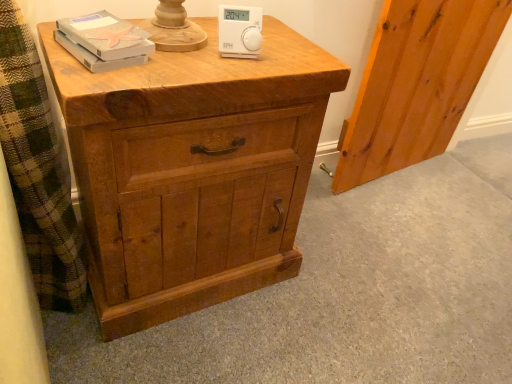
At what (x,y) coordinates should I click in order to perform the action: click on white plastic thermostat at upper center. Please return your answer as a coordinate pair (x, y). This screenshot has height=384, width=512. Looking at the image, I should click on (240, 31).

This screenshot has width=512, height=384. Describe the element at coordinates (240, 31) in the screenshot. I see `white plastic thermostat at upper center` at that location.

What do you see at coordinates (417, 84) in the screenshot?
I see `natural wood screen door at right` at bounding box center [417, 84].

Where is `natural wood chest of drawers at center`? The width and height of the screenshot is (512, 384). natural wood chest of drawers at center is located at coordinates (192, 170).

This screenshot has width=512, height=384. Identify the location of white plastic thermostat at upper center. (240, 31).

From the image's perspective, is natural wood screen door at right positioned above or below natural wood chest of drawers at center?

From the image's perspective, natural wood screen door at right appears above natural wood chest of drawers at center.

Considering the positions of point (416, 67) and point (113, 308), is point (416, 67) closer or farther from the camera than point (113, 308)?

Clearly, point (416, 67) is more distant from the camera than point (113, 308).

Is natural wood screen door at right looking in the opposite direction of natural wood chest of drawers at center?

No, natural wood screen door at right is not facing away from natural wood chest of drawers at center.

From a real-world perspective, which object stands above the other?

From a 3D spatial view, matte gray book at upper left is above.

Does matte gray book at upper left have a smaller size compared to natural wood chest of drawers at center?

Yes, matte gray book at upper left is smaller than natural wood chest of drawers at center.

Between matte gray book at upper left and natural wood chest of drawers at center, which one is positioned in front?

Positioned in front is natural wood chest of drawers at center.

Does point (77, 17) come closer to viewer compared to point (205, 81)?

No.

Can you confirm if natural wood chest of drawers at center is taller than natural wood screen door at right?

No.

Is natural wood chest of drawers at center spatially inside natural wood screen door at right, or outside of it?

The correct answer is: outside.

From a real-world perspective, is natural wood chest of drawers at center above or below natural wood screen door at right?

natural wood chest of drawers at center is situated lower than natural wood screen door at right in the real world.

Does natural wood chest of drawers at center have a smaller size compared to matte gray book at upper left?

No.

Is natural wood chest of drawers at center not inside matte gray book at upper left?

natural wood chest of drawers at center is positioned outside matte gray book at upper left.

Which object is closer to the camera taking this photo, natural wood chest of drawers at center or matte gray book at upper left?

natural wood chest of drawers at center is closer to the camera.

Can you tell me how much natural wood chest of drawers at center and matte gray book at upper left differ in facing direction?

The angular difference between natural wood chest of drawers at center and matte gray book at upper left is 13.2 degrees.

From a real-world perspective, between natural wood screen door at right and white plastic thermostat at upper center, who is vertically lower?

From a 3D spatial view, natural wood screen door at right is below.

Which object is wider, natural wood screen door at right or white plastic thermostat at upper center?

natural wood screen door at right is wider.

Based on their positions, is natural wood screen door at right located to the left or right of white plastic thermostat at upper center?

In the image, natural wood screen door at right appears on the right side of white plastic thermostat at upper center.

How different are the orientations of natural wood screen door at right and white plastic thermostat at upper center in degrees?

natural wood screen door at right and white plastic thermostat at upper center are facing 21.2 degrees away from each other.

Are matte gray book at upper left and natural wood screen door at right far apart?

Absolutely, matte gray book at upper left is distant from natural wood screen door at right.

How distant is matte gray book at upper left from natural wood screen door at right?

matte gray book at upper left and natural wood screen door at right are 3.40 feet apart from each other.

From the image's perspective, is matte gray book at upper left above or below natural wood screen door at right?

Based on their image positions, matte gray book at upper left is located beneath natural wood screen door at right.

Who is taller, matte gray book at upper left or natural wood screen door at right?

Standing taller between the two is natural wood screen door at right.

Which of these two, white plastic thermostat at upper center or natural wood screen door at right, is thinner?

Thinner between the two is white plastic thermostat at upper center.

Considering the relative positions of white plastic thermostat at upper center and natural wood screen door at right in the image provided, is white plastic thermostat at upper center to the left or to the right of natural wood screen door at right?

Clearly, white plastic thermostat at upper center is on the left of natural wood screen door at right in the image.

How much distance is there between white plastic thermostat at upper center and natural wood screen door at right?

The distance of white plastic thermostat at upper center from natural wood screen door at right is 34.54 inches.

Between white plastic thermostat at upper center and natural wood screen door at right, which one has less height?

white plastic thermostat at upper center is shorter.

Where is `the chest of drawers that is below the natural wood screen door at right (from the image's perspective)`? the chest of drawers that is below the natural wood screen door at right (from the image's perspective) is located at coordinates (192, 170).

Find the location of a particular element. This screenshot has width=512, height=384. the chest of drawers that appears in front of the matte gray book at upper left is located at coordinates (192, 170).

Estimate the real-world distances between objects in this image. Which object is further from natural wood chest of drawers at center, natural wood screen door at right or matte gray book at upper left?

Based on the image, natural wood screen door at right appears to be further to natural wood chest of drawers at center.

From the image, which object appears to be farther from natural wood screen door at right, white plastic thermostat at upper center or matte gray book at upper left?

matte gray book at upper left.

From the image, which object appears to be farther from natural wood chest of drawers at center, matte gray book at upper left or natural wood screen door at right?

The object further to natural wood chest of drawers at center is natural wood screen door at right.

Looking at the image, which one is located closer to matte gray book at upper left, natural wood screen door at right or natural wood chest of drawers at center?

The object closer to matte gray book at upper left is natural wood chest of drawers at center.

Estimate the real-world distances between objects in this image. Which object is further from matte gray book at upper left, white plastic thermostat at upper center or natural wood chest of drawers at center?

natural wood chest of drawers at center.

When comparing their distances from matte gray book at upper left, does white plastic thermostat at upper center or natural wood screen door at right seem further?

natural wood screen door at right.

In the scene shown: Based on their spatial positions, is natural wood chest of drawers at center or white plastic thermostat at upper center further from natural wood screen door at right?

white plastic thermostat at upper center lies further to natural wood screen door at right than the other object.

Estimate the real-world distances between objects in this image. Which object is further from white plastic thermostat at upper center, natural wood screen door at right or matte gray book at upper left?

The object further to white plastic thermostat at upper center is natural wood screen door at right.

This screenshot has height=384, width=512. I want to click on ipod located between matte gray book at upper left and natural wood screen door at right in the left-right direction, so tap(240, 31).

Find the location of a particular element. The image size is (512, 384). book between white plastic thermostat at upper center and natural wood chest of drawers at center in the vertical direction is located at coordinates (103, 41).

Locate an element on the screen. The width and height of the screenshot is (512, 384). ipod between natural wood chest of drawers at center and natural wood screen door at right from left to right is located at coordinates point(240,31).

Image resolution: width=512 pixels, height=384 pixels. I want to click on chest of drawers between matte gray book at upper left and natural wood screen door at right, so click(192, 170).